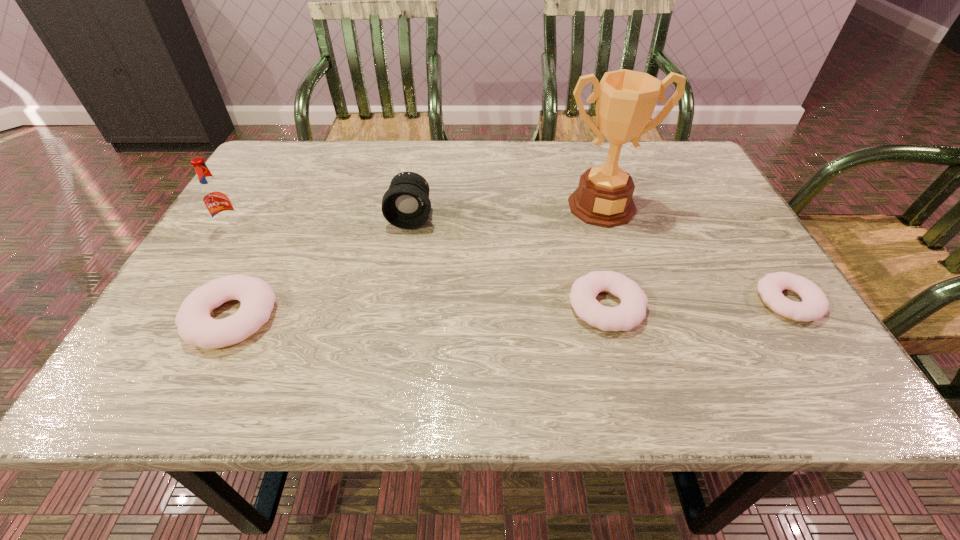
This screenshot has height=540, width=960. In order to click on the leftmost doughnut in this screenshot , I will do `click(196, 327)`.

I want to click on the second shortest object, so click(631, 312).

At what (x,y) coordinates should I click in order to perform the action: click on the second doughnut from right to left. Please return your answer as a coordinate pair (x, y). This screenshot has height=540, width=960. Looking at the image, I should click on (631, 312).

The image size is (960, 540). What are the coordinates of `the shortest object` in the screenshot? It's located at coord(814,305).

Where is `the shortest doughnut`? Image resolution: width=960 pixels, height=540 pixels. the shortest doughnut is located at coordinates (814, 305).

Where is `award`? The width and height of the screenshot is (960, 540). award is located at coordinates (626, 99).

In order to click on the fourth shortest object in this screenshot , I will do `click(406, 204)`.

Find the location of a particular element. The image size is (960, 540). telephoto lens is located at coordinates (406, 204).

This screenshot has width=960, height=540. I want to click on the fifth shortest object, so click(215, 197).

I want to click on vacant space located on the back of the leftmost doughnut, so click(272, 237).